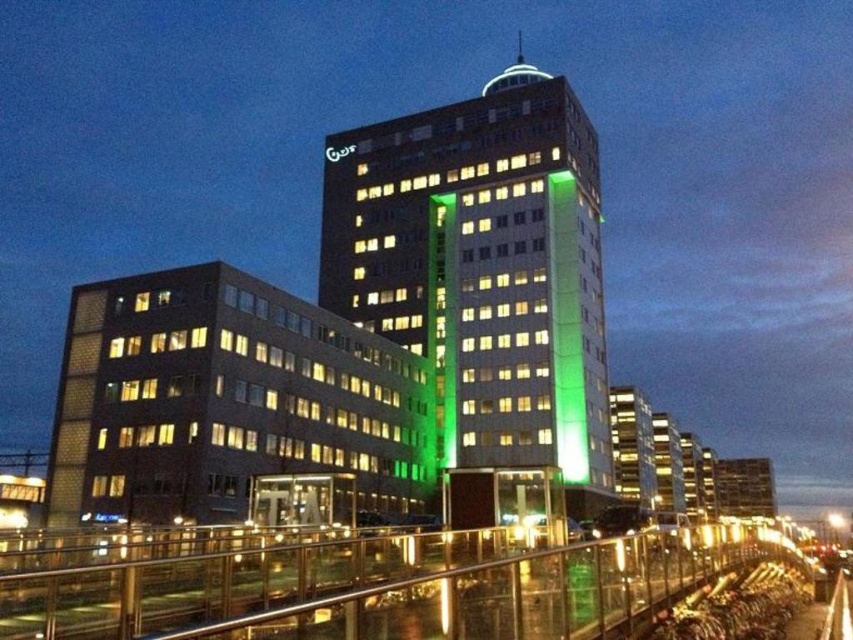
Is brown brick building at lower left to the right of clear glass railing at lower center from the viewer's perspective?

In fact, brown brick building at lower left is to the left of clear glass railing at lower center.

Can you confirm if brown brick building at lower left is bigger than clear glass railing at lower center?

No.

Is point (77, 406) positioned behind point (608, 589)?

Yes.

Where is `brown brick building at lower left`? This screenshot has height=640, width=853. brown brick building at lower left is located at coordinates point(225,401).

Is brown brick building at lower left in front of green glass sign at upper center?

That is True.

Does brown brick building at lower left have a lesser width compared to green glass sign at upper center?

Incorrect, brown brick building at lower left's width is not less than green glass sign at upper center's.

Where is `brown brick building at lower left`? This screenshot has height=640, width=853. brown brick building at lower left is located at coordinates pos(225,401).

At what (x,y) coordinates should I click in order to perform the action: click on brown brick building at lower left. Please return your answer as a coordinate pair (x, y). This screenshot has width=853, height=640. Looking at the image, I should click on (225, 401).

Is point (523, 275) in front of point (693, 588)?

That is False.

Who is positioned more to the right, green glass building at center or clear glass railing at lower center?

green glass building at center

Is point (345, 184) positioned before point (321, 566)?

No, (345, 184) is behind (321, 566).

Locate an element on the screen. The height and width of the screenshot is (640, 853). green glass building at center is located at coordinates (485, 272).